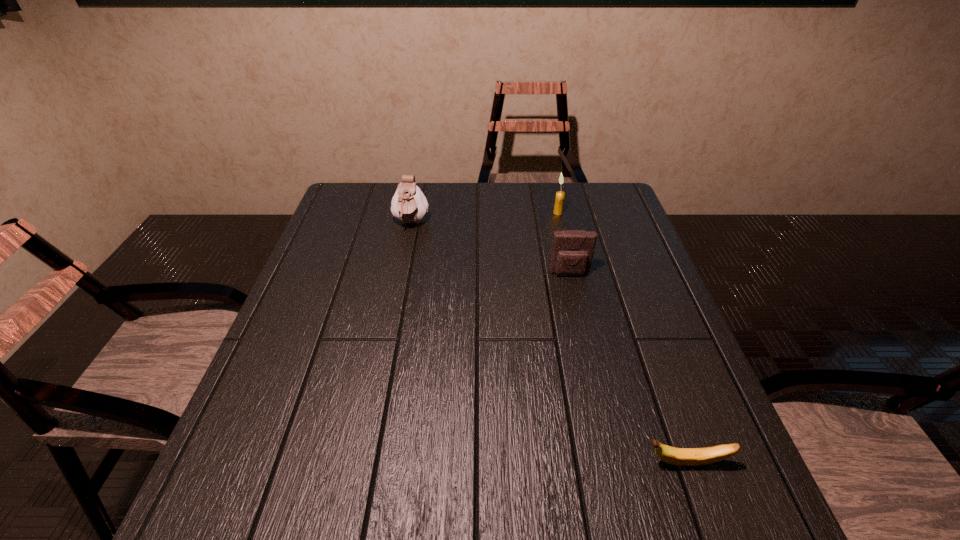
This screenshot has width=960, height=540. Find the location of `vacant space located at the stem of the shortest object`. vacant space located at the stem of the shortest object is located at coordinates click(x=554, y=463).

The image size is (960, 540). What are the coordinates of `vacant region located 0.370m at the stem of the shortest object` in the screenshot? It's located at (437, 463).

You are a GUI agent. You are given a task and a screenshot of the screen. Output one action in this format:
    pyautogui.click(x=<x>, y=<y>)
    Task: Click on the vacant area located 0.120m at the stem of the shortest object
    The height and width of the screenshot is (540, 960).
    Given the screenshot: What is the action you would take?
    pyautogui.click(x=576, y=463)

This screenshot has width=960, height=540. I want to click on pouch at the far edge, so click(409, 205).

Identify the location of candle that is at the far edge. This screenshot has width=960, height=540. (560, 195).

You are a GUI agent. You are given a task and a screenshot of the screen. Output one action in this format:
    pyautogui.click(x=<x>, y=<y>)
    Task: Click on the object positioned at the right edge
    This screenshot has width=960, height=540.
    Given the screenshot: What is the action you would take?
    pyautogui.click(x=676, y=456)

Where is `free spot at the far edge of the desktop`? This screenshot has height=540, width=960. free spot at the far edge of the desktop is located at coordinates (504, 198).

Where is `free space at the near edge of the desktop`? This screenshot has width=960, height=540. free space at the near edge of the desktop is located at coordinates (512, 523).

Locate an element on the screen. The image size is (960, 540). vacant space at the left edge is located at coordinates coord(349,241).

At what (x,y) coordinates should I click in order to perform the action: click on free space at the right edge of the desktop. Please return your answer as a coordinate pair (x, y). Looking at the image, I should click on (643, 271).